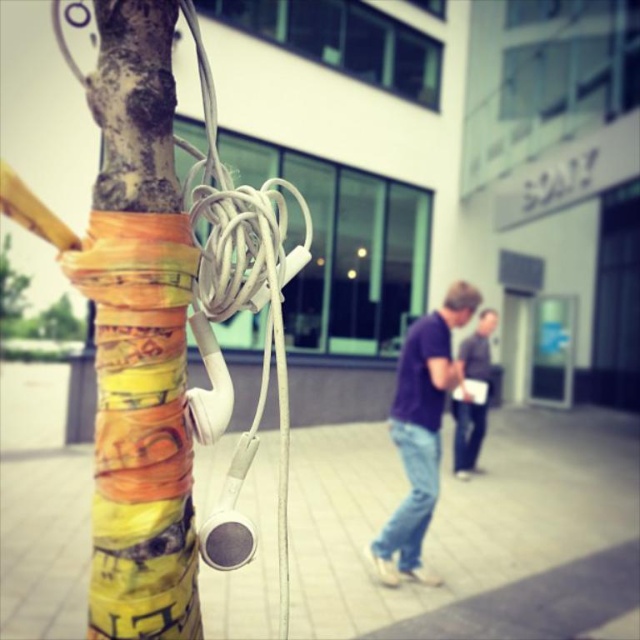
You are a delivery person who needs to place a small package between the multicolored paper at center and the denim jeans at center. Based on their heights, which object should you place the package closer to?

The multicolored paper at center is taller than the denim jeans at center, so you should place the package closer to the denim jeans at center to ensure stability.

From the picture: You are a fashion designer observing an urban scene where a person is wearing a purple matte shirt at center and denim jeans at center. Based on the scene description, can you determine which clothing item is closer to the ground?

The purple matte shirt at center is positioned under denim jeans at center, so the purple matte shirt at center is closer to the ground than the denim jeans at center.